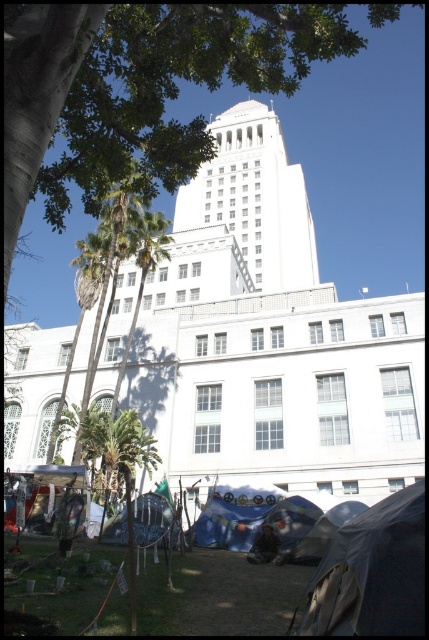
You are a photographer standing in front of the white marble tower at center. You want to take a photo of the dark gray fabric tent at lower right without the tower blocking the view. Is it possible to do so?

The dark gray fabric tent at lower right is behind the white marble tower at center, so you cannot take a photo of the dark gray fabric tent at lower right without the tower blocking the view.

You are a photographer standing in the grassy area in front of the white marble tower at center. You want to take a photo of the tower from a distance that allows you to capture its full height without cropping the top or bottom. Considering the camera you have can only focus on subjects within 20 meters, will you be able to take the photo from your current position?

The white marble tower at center is 25.26 meters away from the camera. Since the camera can only focus within 20 meters, you are currently too far away to capture the tower clearly. Move closer to within 20 meters to ensure proper focus and framing.

Consider the image. You are a photographer standing in front of the government building. You want to capture a photo of the blue tarp at lower center and the transparent plastic tent at lower center. Which object should you focus on first to ensure both are in the frame?

You should focus on the blue tarp at lower center first since it is closer to the viewer than the transparent plastic tent at lower center, ensuring both are in the frame by adjusting the camera angle accordingly.